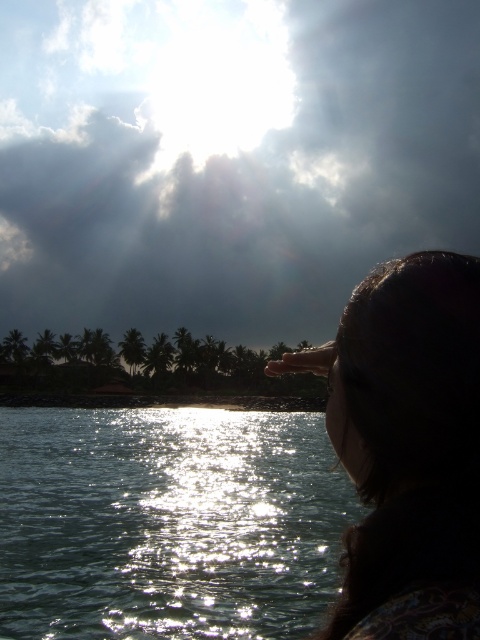
You are an artist trying to paint this coastal scene. You want to ensure the cloudy sky at upper center and the silhouette hair at upper right are positioned correctly in terms of depth. Which object should appear closer to the viewer in your painting?

The silhouette hair at upper right should appear closer to the viewer because the cloudy sky at upper center is further away according to the description.

You are standing at the point marked as point (168, 524) in the image. What do you see in the direction of the sparkling silver water at lower left?

You see sparkling silver water at lower left located at point (168, 524).